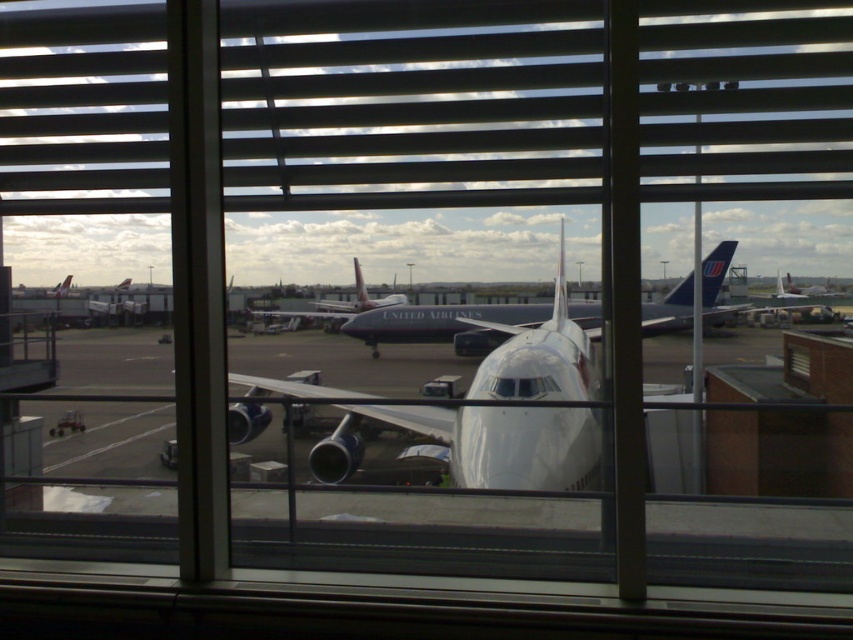
You are a baggage cart operator who needs to move a cart that is 3 meters long through the space between the white matte airplane at center and the matte white airplane at center. Can the cart fit through the space between them?

The white matte airplane at center and the matte white airplane at center are 3.32 meters apart. Since the cart is 3 meters long, it can fit through the space between them as the distance is greater than the cart length.

You are an airport maintenance worker checking the window. You notice the smooth plastic blinds at center and the white glossy airplane at center. Which object is wider from your current viewpoint?

The smooth plastic blinds at center might be wider than white glossy airplane at center according to the description.